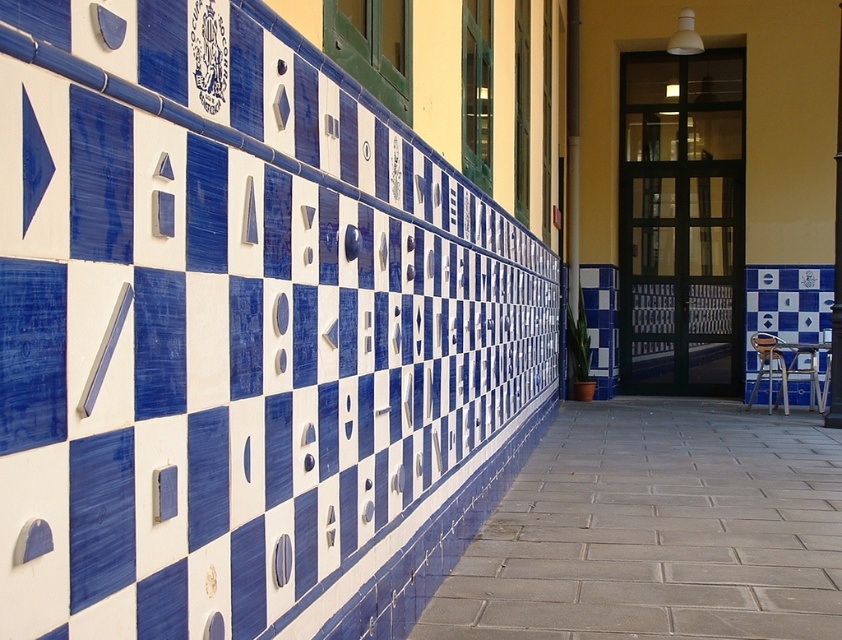
In the scene shown: Between blue glossy tiles at upper left and metallic silver chair at lower right, which one is positioned lower?

Positioned lower is metallic silver chair at lower right.

Who is higher up, blue glossy tiles at upper left or metallic silver chair at lower right?

blue glossy tiles at upper left

Consider the image. Who is more distant from viewer, [248,358] or [809,349]?

The point [809,349] is more distant.

This screenshot has height=640, width=842. Identify the location of blue glossy tiles at upper left. (265, 307).

Which of these two, blue glossy tiles at upper left or blue glossy tile at center, stands shorter?

blue glossy tile at center

Can you confirm if blue glossy tiles at upper left is shorter than blue glossy tile at center?

No, blue glossy tiles at upper left is not shorter than blue glossy tile at center.

This screenshot has width=842, height=640. Find the location of `blue glossy tiles at upper left`. blue glossy tiles at upper left is located at coordinates (265, 307).

Can you confirm if blue glossy tile at center is wider than metallic silver chair at lower right?

Indeed, blue glossy tile at center has a greater width compared to metallic silver chair at lower right.

Who is shorter, blue glossy tile at center or metallic silver chair at lower right?

With less height is blue glossy tile at center.

Is point (440, 620) closer to viewer compared to point (807, 358)?

Yes, it is in front of point (807, 358).

Where is `blue glossy tile at center`? This screenshot has height=640, width=842. blue glossy tile at center is located at coordinates (657, 531).